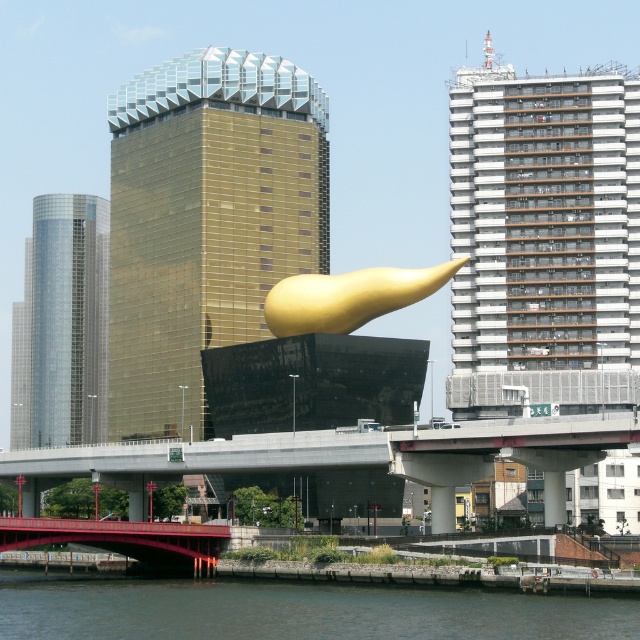
You are an architect evaluating the city skyline. You notice the gold reflective glass building at center and the shiny glass skyscraper at left. Which of these two buildings is shorter?

The gold reflective glass building at center is smaller than the shiny glass skyscraper at left, so it is the shorter one.

You are standing at the camera position and want to take a photo of the gold reflective glass building at center. If your camera can focus up to 150 meters, will it be able to capture the building clearly?

The gold reflective glass building at center is 151.43 meters away from the camera. Since the camera can only focus up to 150 meters, it will not be able to capture the building clearly.

You are a photographer planning to capture a shot of the white textured building at upper right and dark gray water at lower left. Which object is located to the right side of the other?

The white textured building at upper right is positioned on the right side of dark gray water at lower left.